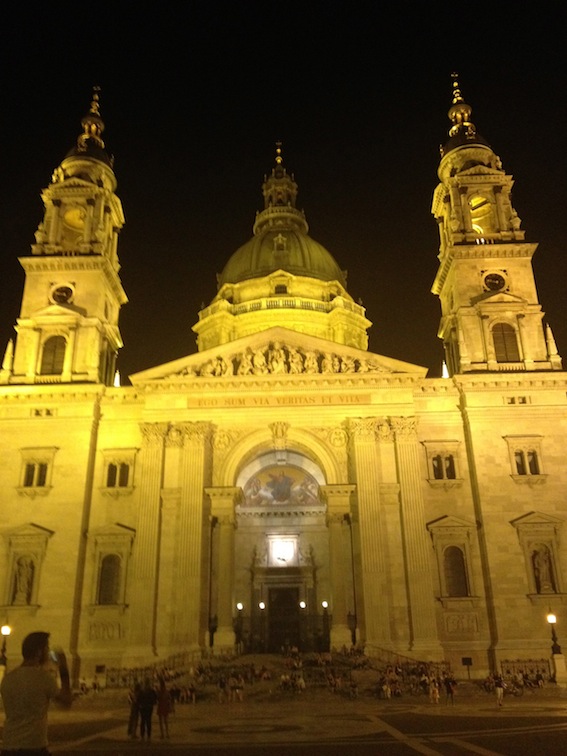
Identify the location of door. The width and height of the screenshot is (567, 756). (270, 631).